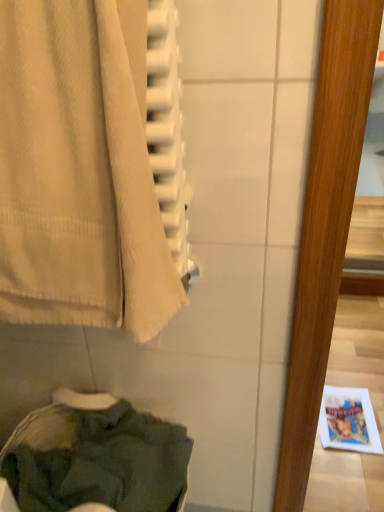
Question: Is dark green fabric at lower left completely or partially inside beige cotton towel at left?

Choices:
 (A) yes
 (B) no

Answer: (B)

Question: Can you confirm if beige cotton towel at left is smaller than dark green fabric at lower left?

Choices:
 (A) no
 (B) yes

Answer: (B)

Question: Considering the relative sizes of beige cotton towel at left and dark green fabric at lower left in the image provided, is beige cotton towel at left shorter than dark green fabric at lower left?

Choices:
 (A) no
 (B) yes

Answer: (B)

Question: From a real-world perspective, is beige cotton towel at left below dark green fabric at lower left?

Choices:
 (A) no
 (B) yes

Answer: (A)

Question: Is the surface of beige cotton towel at left in direct contact with dark green fabric at lower left?

Choices:
 (A) no
 (B) yes

Answer: (A)

Question: Would you say beige cotton towel at left is outside dark green fabric at lower left?

Choices:
 (A) no
 (B) yes

Answer: (B)

Question: Is dark green fabric at lower left shorter than beige cotton towel at left?

Choices:
 (A) yes
 (B) no

Answer: (B)

Question: Considering the relative sizes of dark green fabric at lower left and beige cotton towel at left in the image provided, is dark green fabric at lower left wider than beige cotton towel at left?

Choices:
 (A) no
 (B) yes

Answer: (B)

Question: Is dark green fabric at lower left at the left side of beige cotton towel at left?

Choices:
 (A) yes
 (B) no

Answer: (A)

Question: Is dark green fabric at lower left next to beige cotton towel at left?

Choices:
 (A) yes
 (B) no

Answer: (B)

Question: Is dark green fabric at lower left further to the viewer compared to beige cotton towel at left?

Choices:
 (A) no
 (B) yes

Answer: (B)

Question: Is dark green fabric at lower left oriented towards beige cotton towel at left?

Choices:
 (A) yes
 (B) no

Answer: (B)

Question: From the image's perspective, is dark green fabric at lower left above or below beige cotton towel at left?

Choices:
 (A) below
 (B) above

Answer: (A)